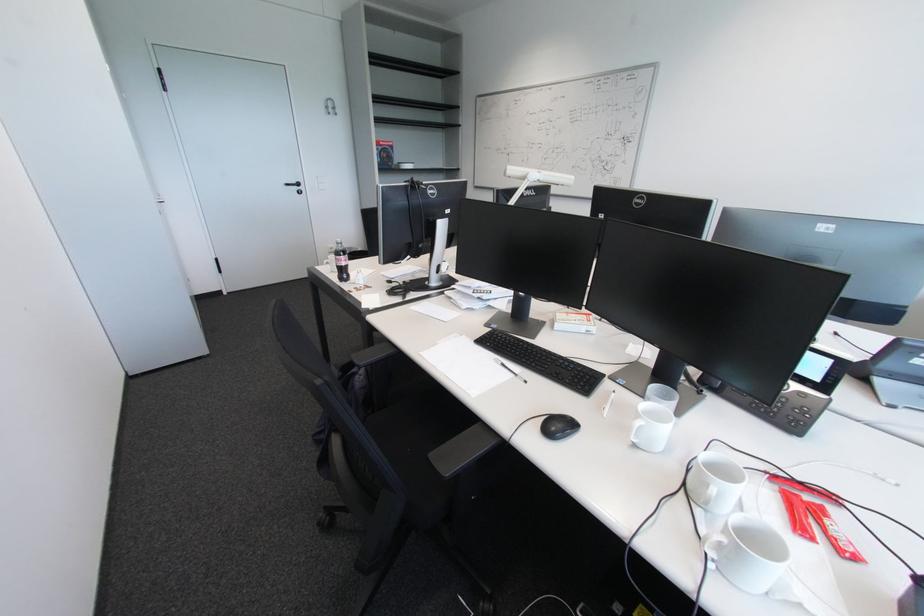
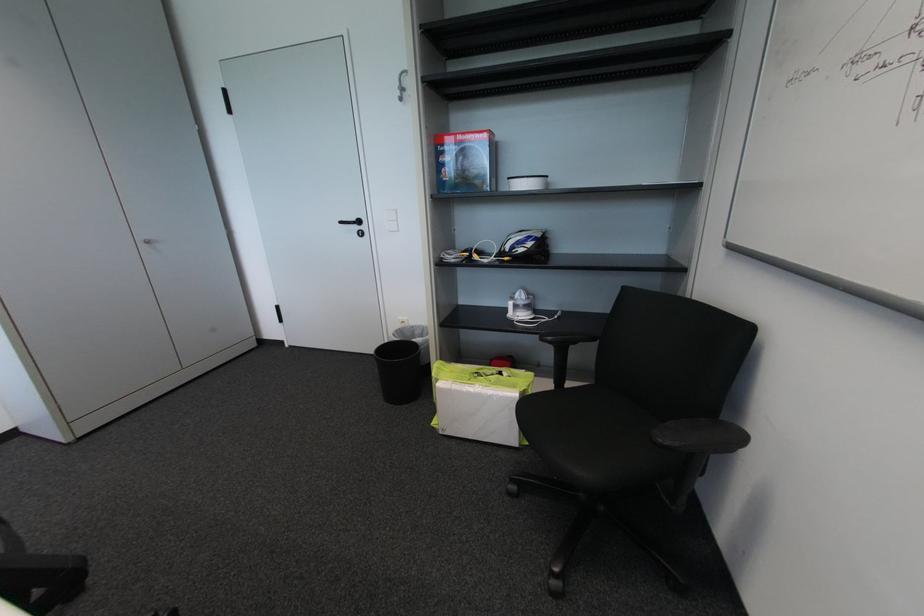
Find the pixel in the second image that matches point 387,145 in the first image.

(466, 139)